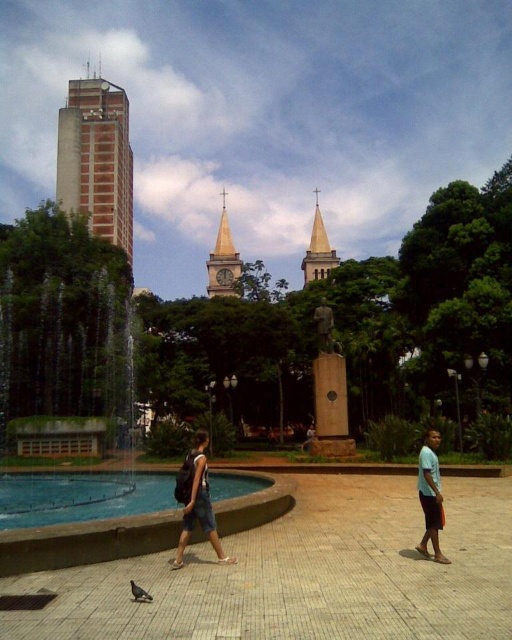
Question: Can you confirm if concrete tower at left is positioned above gray matte pigeon at lower left?

Choices:
 (A) no
 (B) yes

Answer: (B)

Question: Which object is the farthest from the concrete tower at left?

Choices:
 (A) gray matte pigeon at lower left
 (B) smooth stone spire at center

Answer: (A)

Question: Which object is closer to the camera taking this photo?

Choices:
 (A) concrete tower at left
 (B) gray matte pigeon at lower left
 (C) light blue cotton shirt at lower right

Answer: (B)

Question: Observing the image, what is the correct spatial positioning of smooth stone spire at center in reference to gray matte pigeon at lower left?

Choices:
 (A) below
 (B) above

Answer: (B)

Question: Is light blue cotton shirt at lower right positioned at the back of gray matte pigeon at lower left?

Choices:
 (A) yes
 (B) no

Answer: (A)

Question: Which object is farther from the camera taking this photo?

Choices:
 (A) concrete tower at left
 (B) denim shorts at center
 (C) light blue cotton shirt at lower right
 (D) smooth stone spire at center

Answer: (D)